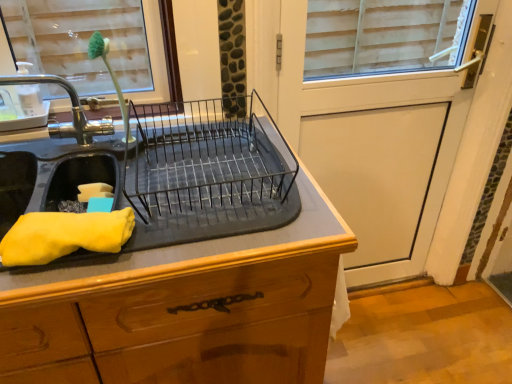
Identify the location of black rubber mat at center. The width and height of the screenshot is (512, 384). (182, 308).

Image resolution: width=512 pixels, height=384 pixels. What do you see at coordinates (64, 235) in the screenshot?
I see `yellow fabric at left` at bounding box center [64, 235].

Locate an element on the screen. This screenshot has width=512, height=384. black metal dish rack at center is located at coordinates (207, 161).

Locate an element on the screen. Image resolution: width=512 pixels, height=384 pixels. black rubber mat at center is located at coordinates (182, 308).

Does point (84, 237) come in front of point (88, 140)?

Yes.

Is the surface of yellow fabric at left in direct contact with brushed metal tap at left?

There is a gap between yellow fabric at left and brushed metal tap at left.

You are a GUI agent. You are given a task and a screenshot of the screen. Output one action in this format:
    pyautogui.click(x=<x>, y=<y>)
    Task: Click on the tap behind the yellow fabric at left
    This screenshot has width=512, height=384.
    Given the screenshot: What is the action you would take?
    pyautogui.click(x=72, y=111)

From a real-world perspective, is yellow fabric at left positioned under brushed metal tap at left based on gravity?

Correct, in the physical world, yellow fabric at left is lower than brushed metal tap at left.

Find the location of a particular element. countertop below the brushed metal tap at left (from the image's perspective) is located at coordinates (182, 308).

Is black rubber mat at center further to the viewer compared to brushed metal tap at left?

No, the depth of black rubber mat at center is less than that of brushed metal tap at left.

Considering the sizes of objects black rubber mat at center and brushed metal tap at left in the image provided, who is wider, black rubber mat at center or brushed metal tap at left?

black rubber mat at center.

Does point (106, 351) appear closer or farther from the camera than point (1, 79)?

Point (106, 351) is positioned closer to the camera compared to point (1, 79).

Is black metal dish rack at center in front of or behind brushed metal tap at left in the image?

black metal dish rack at center is in front of brushed metal tap at left.

Is brushed metal tap at left at the back of black metal dish rack at center?

No, black metal dish rack at center's orientation is not away from brushed metal tap at left.

Is black metal dish rack at center wider than brushed metal tap at left?

Correct, the width of black metal dish rack at center exceeds that of brushed metal tap at left.

From a real-world perspective, is black metal dish rack at center physically located above or below brushed metal tap at left?

black metal dish rack at center is situated lower than brushed metal tap at left in the real world.

From a real-world perspective, is brushed metal tap at left over white matte screen door at upper right?

Correct, in the physical world, brushed metal tap at left is higher than white matte screen door at upper right.

Is white matte screen door at upper right located within brushed metal tap at left?

No, white matte screen door at upper right is not inside brushed metal tap at left.

Considering the relative sizes of brushed metal tap at left and white matte screen door at upper right in the image provided, is brushed metal tap at left taller than white matte screen door at upper right?

No.

Is brushed metal tap at left wider or thinner than white matte screen door at upper right?

Clearly, brushed metal tap at left has more width compared to white matte screen door at upper right.

Is black metal dish rack at center directly adjacent to white matte screen door at upper right?

black metal dish rack at center and white matte screen door at upper right are not in contact.

Looking at this image, looking at their sizes, would you say black metal dish rack at center is wider or thinner than white matte screen door at upper right?

In the image, black metal dish rack at center appears to be wider than white matte screen door at upper right.

Is black metal dish rack at center positioned behind white matte screen door at upper right?

No, black metal dish rack at center is closer to the camera.

Which is correct: yellow fabric at left is inside black rubber mat at center, or outside of it?

yellow fabric at left cannot be found inside black rubber mat at center.

Is point (18, 251) closer or farther from the camera than point (246, 273)?

Point (18, 251) is positioned closer to the camera compared to point (246, 273).

Does yellow fabric at left have a greater height compared to black rubber mat at center?

No, yellow fabric at left is not taller than black rubber mat at center.

Is yellow fabric at left oriented towards black rubber mat at center?

No.

Does brushed metal tap at left touch yellow fabric at left?

Result: brushed metal tap at left is not next to yellow fabric at left, and they're not touching.

Locate an element on the screen. Image resolution: width=512 pixels, height=384 pixels. material that is under the brushed metal tap at left (from a real-world perspective) is located at coordinates (64, 235).

Consider the image. Who is bigger, brushed metal tap at left or yellow fabric at left?

brushed metal tap at left is bigger.

From a real-world perspective, is brushed metal tap at left above or below yellow fabric at left?

In terms of real-world spatial position, brushed metal tap at left is above yellow fabric at left.

Find the location of `material located underneath the brushed metal tap at left (from a real-world perspective)`. material located underneath the brushed metal tap at left (from a real-world perspective) is located at coordinates (64, 235).

Locate an element on the screen. countertop in front of the brushed metal tap at left is located at coordinates pos(182,308).

From the picture: Looking at the image, which one is located closer to black metal dish rack at center, yellow fabric at left or brushed metal tap at left?

yellow fabric at left lies closer to black metal dish rack at center than the other object.

Estimate the real-world distances between objects in this image. Which object is further from yellow fabric at left, black rubber mat at center or black metal dish rack at center?

Among the two, black metal dish rack at center is located further to yellow fabric at left.

Looking at the image, which one is located further to white matte screen door at upper right, black rubber mat at center or yellow fabric at left?

yellow fabric at left.

Based on their spatial positions, is brushed metal tap at left or black metal dish rack at center closer to white matte screen door at upper right?

black metal dish rack at center is positioned closer to the anchor white matte screen door at upper right.

Based on the photo, based on their spatial positions, is brushed metal tap at left or white matte screen door at upper right further from black rubber mat at center?

white matte screen door at upper right is positioned further to the anchor black rubber mat at center.

Considering their positions, is black metal dish rack at center positioned closer to brushed metal tap at left than black rubber mat at center?

Based on the image, black metal dish rack at center appears to be nearer to brushed metal tap at left.

From the image, which object appears to be nearer to black metal dish rack at center, yellow fabric at left or white matte screen door at upper right?

yellow fabric at left.

Looking at this image, from the image, which object appears to be nearer to brushed metal tap at left, yellow fabric at left or black metal dish rack at center?

Among the two, black metal dish rack at center is located nearer to brushed metal tap at left.

Find the location of a particular element. The height and width of the screenshot is (384, 512). countertop between brushed metal tap at left and white matte screen door at upper right from left to right is located at coordinates (182, 308).

Find the location of a particular element. This screenshot has height=384, width=512. appliance located between black rubber mat at center and white matte screen door at upper right in the left-right direction is located at coordinates (207, 161).

This screenshot has width=512, height=384. In order to click on material between black rubber mat at center and white matte screen door at upper right in the horizontal direction in this screenshot , I will do `click(64, 235)`.

The height and width of the screenshot is (384, 512). Identify the location of appliance between brushed metal tap at left and black rubber mat at center from top to bottom. (207, 161).